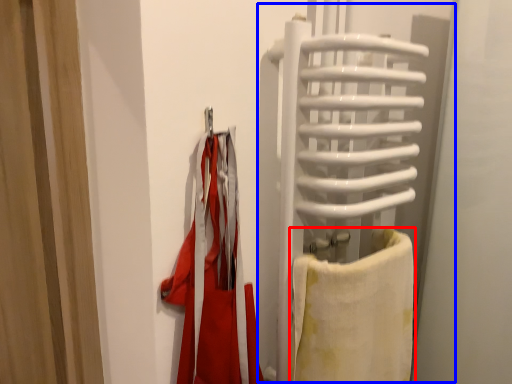
Question: Which object appears farthest to the camera in this image, towel (highlighted by a red box) or screen door (highlighted by a blue box)?

Choices:
 (A) towel
 (B) screen door

Answer: (A)